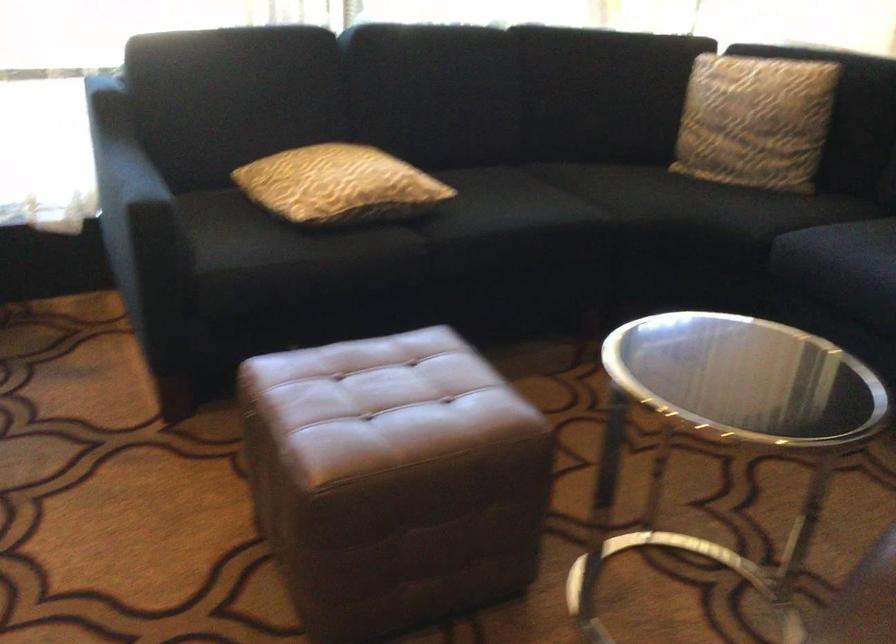
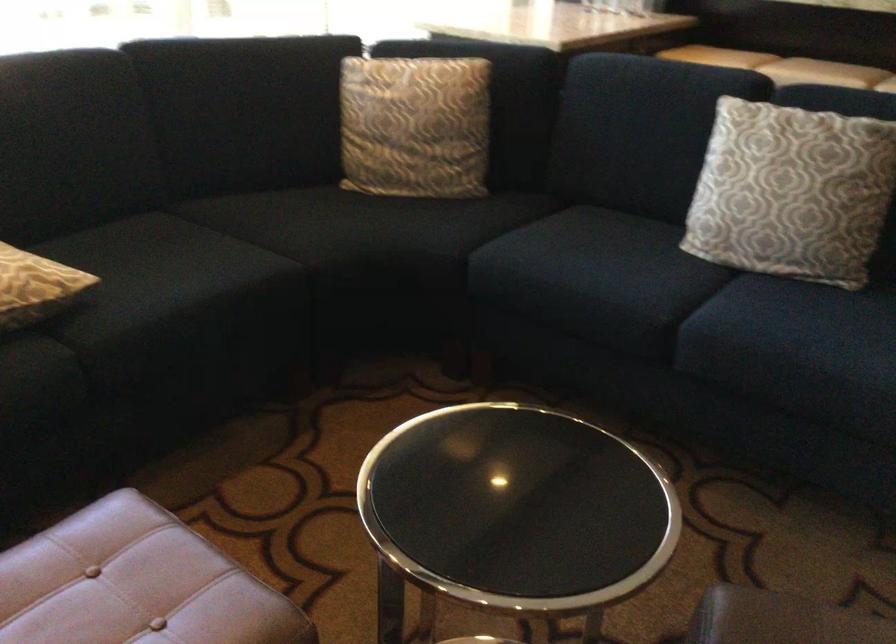
The point at (405, 191) is marked in the first image. Where is the corresponding point in the second image?

(35, 287)